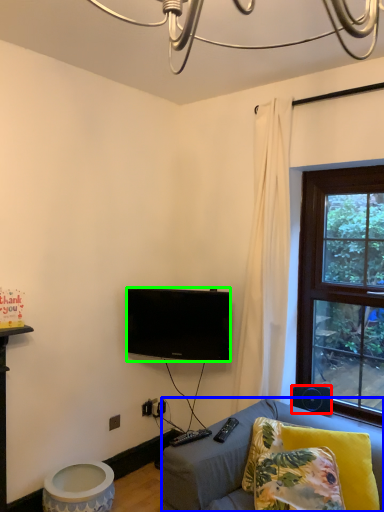
Question: Which is farther away from loudspeaker (highlighted by a red box)? studio couch (highlighted by a blue box) or television (highlighted by a green box)?

Choices:
 (A) studio couch
 (B) television

Answer: (B)